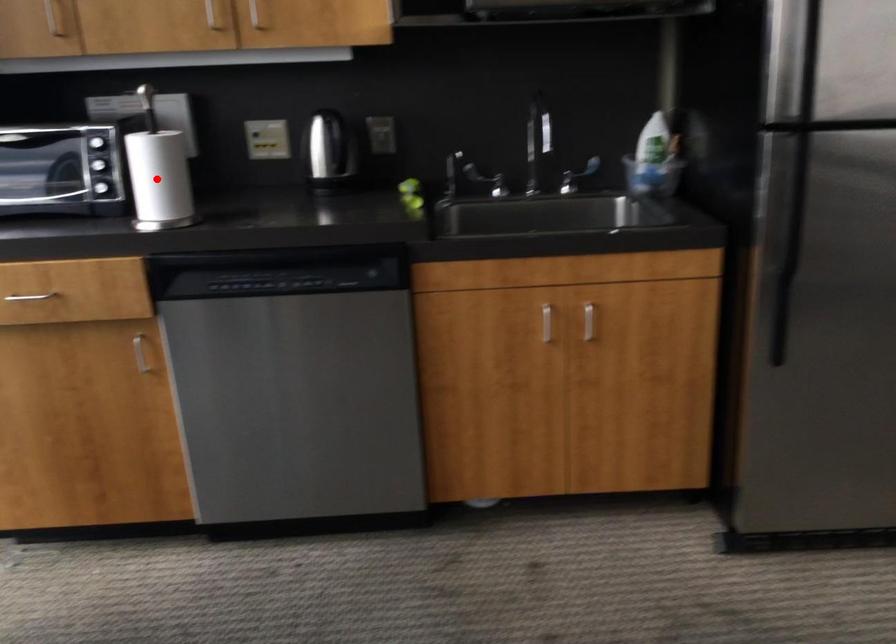
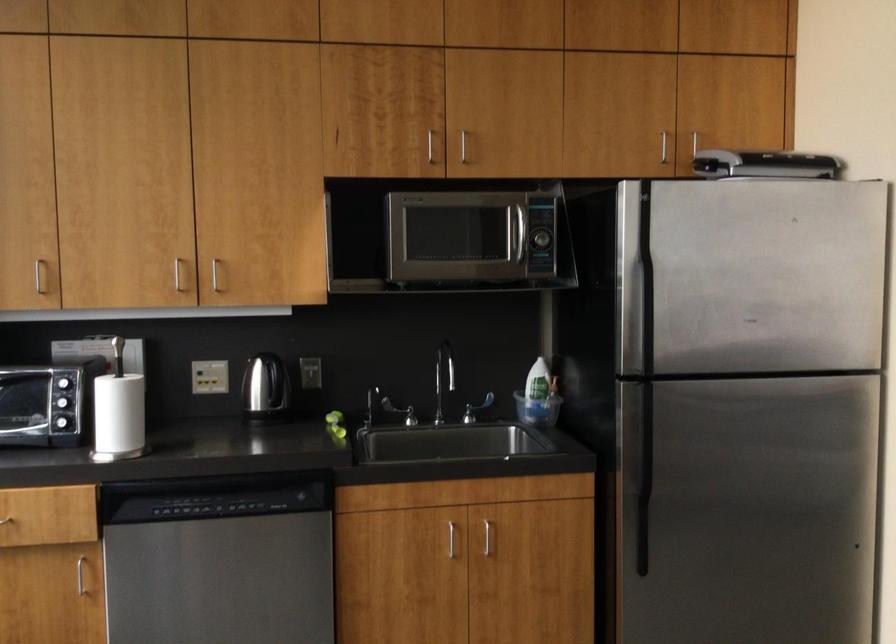
Question: I am providing you with two images of the same scene from different viewpoints. In image1, a red point is highlighted. Considering the same 3D point in image2, which of the following is correct?

Choices:
 (A) It is closer
 (B) It is farther

Answer: (B)